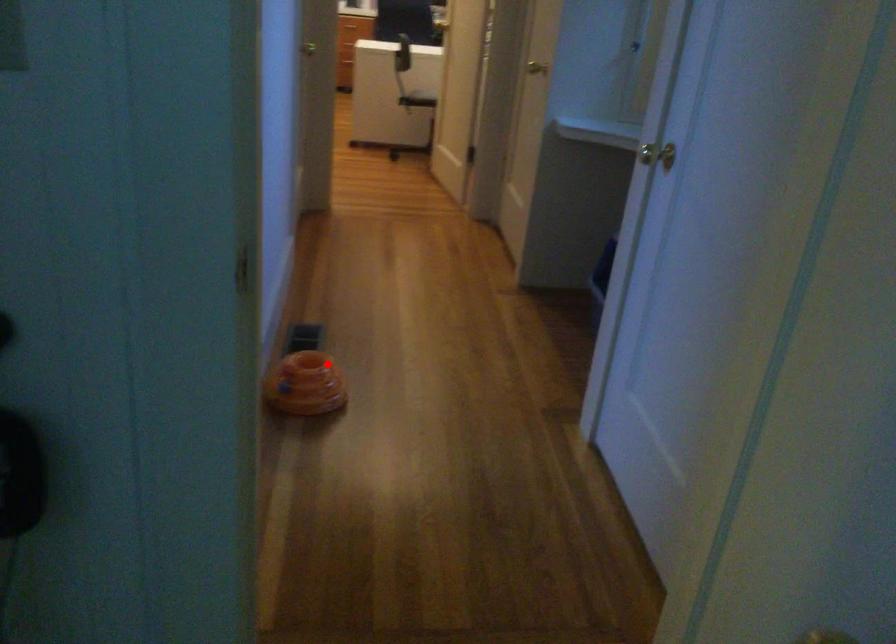
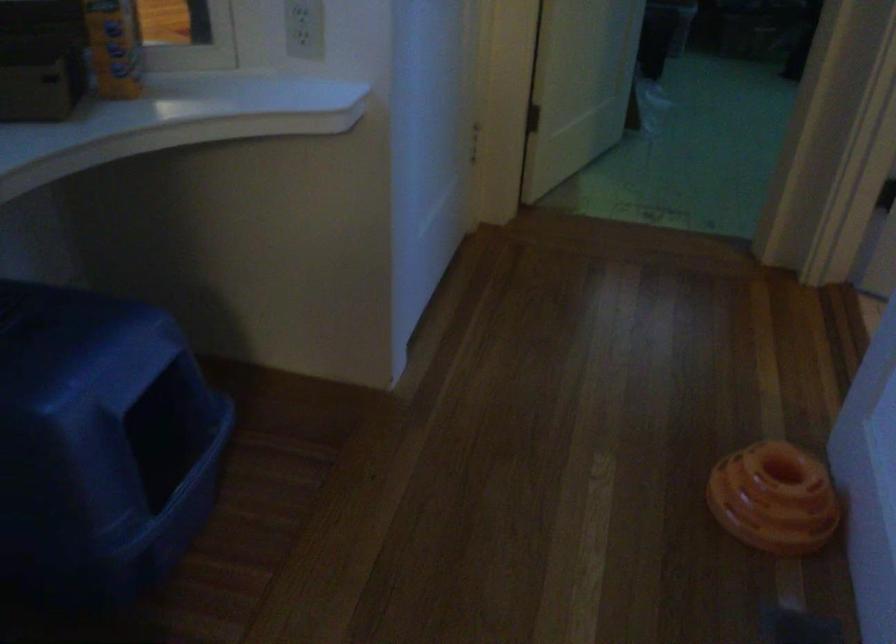
Question: I am providing you with two images of the same scene from different viewpoints. A red point is marked on the first image. Can you still see the location of the red point in image 2?

Choices:
 (A) Yes
 (B) No

Answer: (A)